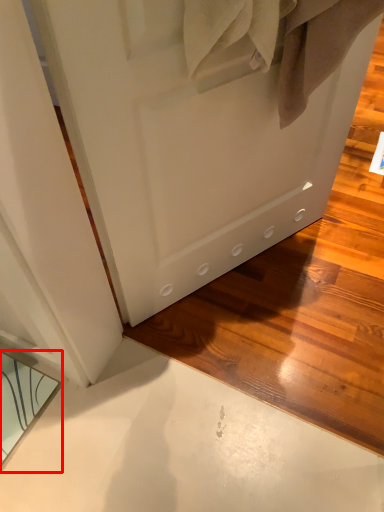
Question: From the image's perspective, what is the correct spatial relationship of mirror (annotated by the red box) in relation to door?

Choices:
 (A) above
 (B) below

Answer: (B)